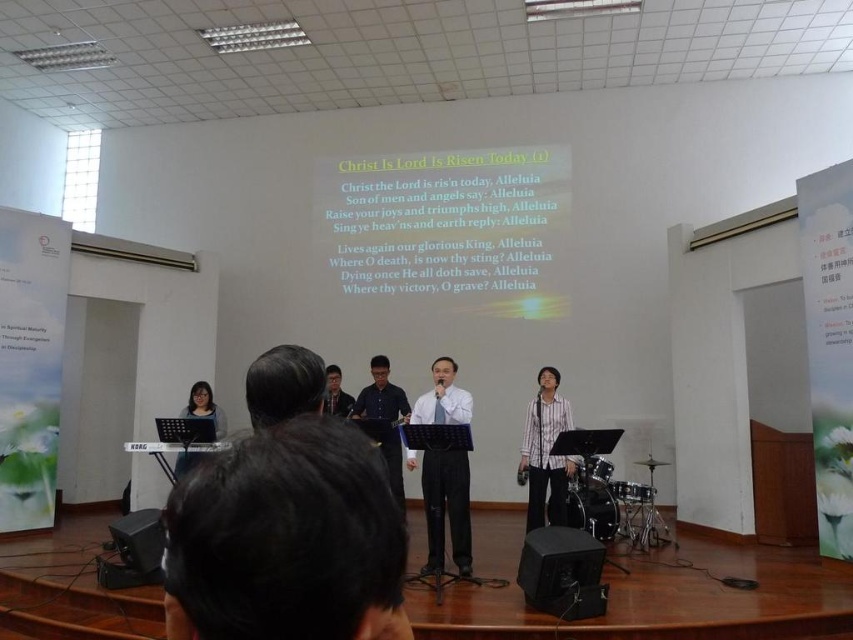
You are an event photographer in a worship setting. You need to capture a photo of the white striped shirt at right and the yellow paper at center. Based on their positions, which object should you focus on first if you want to include both in the frame without moving the camera?

The yellow paper at center is located above the white striped shirt at right, so you should focus on the yellow paper at center first to ensure both are in the frame.